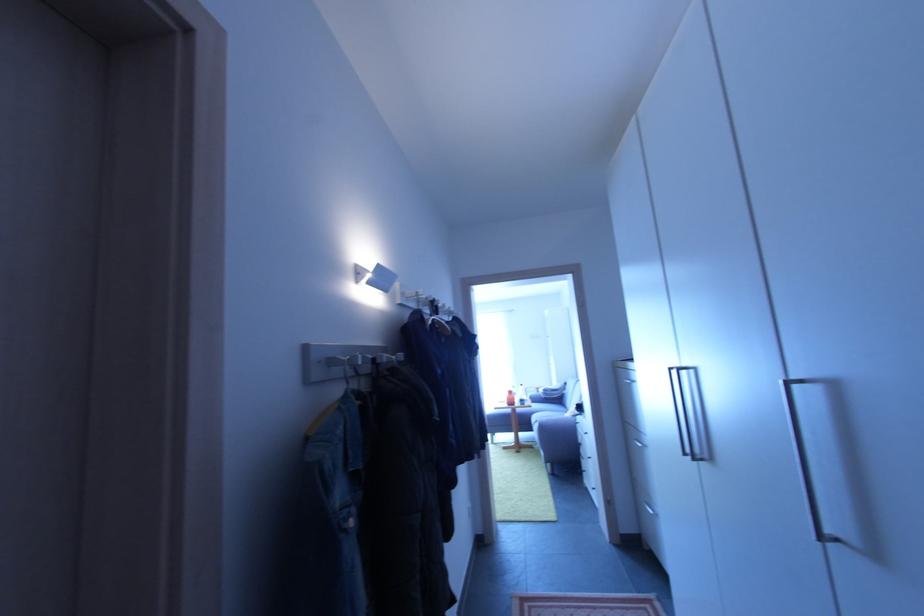
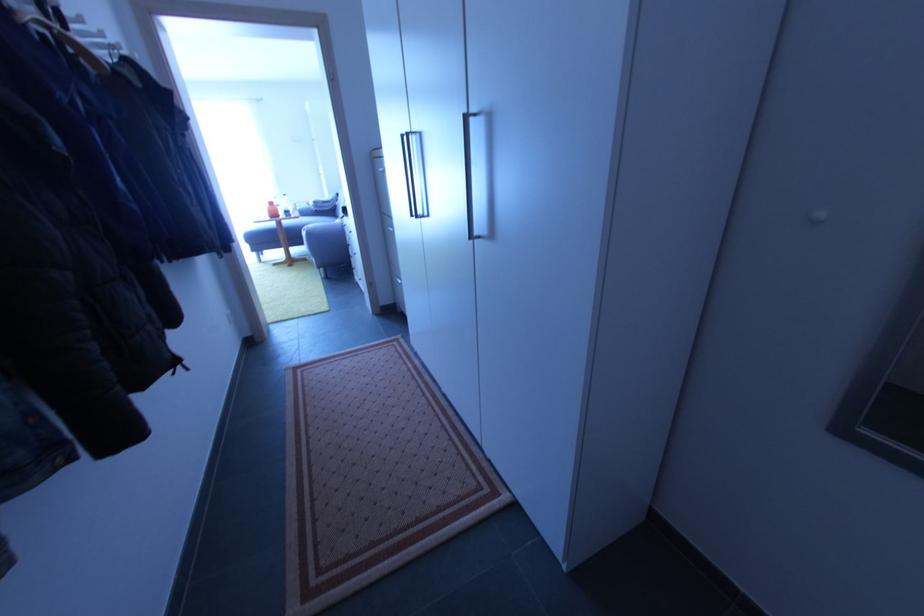
Where in the second image is the point corresponding to [675,371] from the first image?

(407, 138)